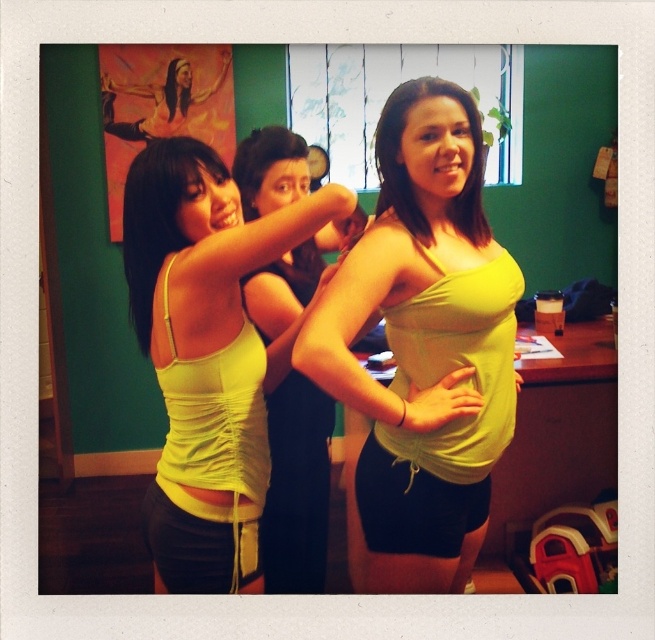
You are standing in front of the scene and want to locate the matte yellow tank top at center. What are the coordinates where you can find it?

The matte yellow tank top at center is located at coordinates point (x=208, y=355).

You are a photographer setting up for a group photo. You have two subjects wearing lime green fabric top at center and matte yellow tank top at center. The camera you are using has a minimum focus distance of 10 inches. Can both subjects be in focus if they are positioned exactly as shown in the image?

The distance between the lime green fabric top at center and matte yellow tank top at center is 10.40 inches, which exceeds the camera minimum focus distance of 10 inches. Therefore, both subjects can be in focus when positioned as shown.

You are a photographer adjusting the lighting for a group photo. You need to ensure that both the matte yellow fabric at center and the yellow fabric at lower center are evenly lit. Given their distance apart, can you estimate the minimum width of the lighting equipment needed to cover both areas simultaneously?

The matte yellow fabric at center is 35.60 centimeters from the yellow fabric at lower center. To cover both areas evenly, the lighting equipment must be at least 35.60 centimeters wide to ensure both fabrics are illuminated without shadows.